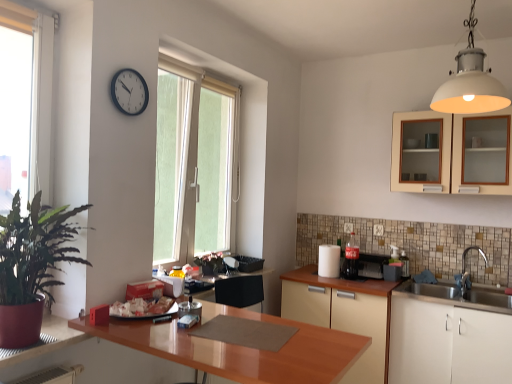
Identify the location of vacant area situated below white paper towel at center, the 3th appliance from the right (from a real-world perspective). The width and height of the screenshot is (512, 384). (328, 276).